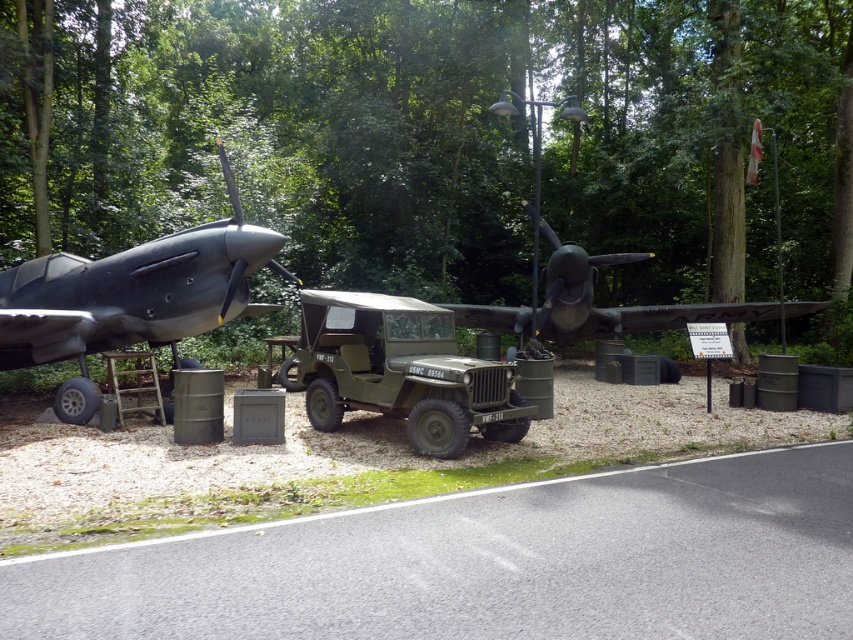
You are a tour guide leading a group through the outdoor military exhibit. You want to ensure visitors can comfortably walk between the matte black airplane at left and the matte green jeep at center. The path between them is 2.33 meters wide. If a visitor is using a wheelchair that is 0.8 meters wide, will they have enough space to maneuver between them?

The path between the matte black airplane at left and the matte green jeep at center is 2.33 meters wide, so yes, a wheelchair with a width of 0.8 meters will have sufficient space to maneuver between them since the path is wider than the wheelchair.

From the picture: You are a photographer planning to capture a wide shot of the military jeep in the center. The green textured tree at upper center and the matte black airplane at left are in the background. Which background object is wider?

The green textured tree at upper center is wider than the matte black airplane at left.

You are a drone operator tasked with capturing aerial footage of the vintage military jeep in the center. The green textured tree at upper center is blocking your view. What are the coordinates of the tree to avoid it?

The green textured tree at upper center is located at coordinates point (462,136), so you should adjust your drone path to avoid this point to capture clear footage of the vintage military jeep in the center.